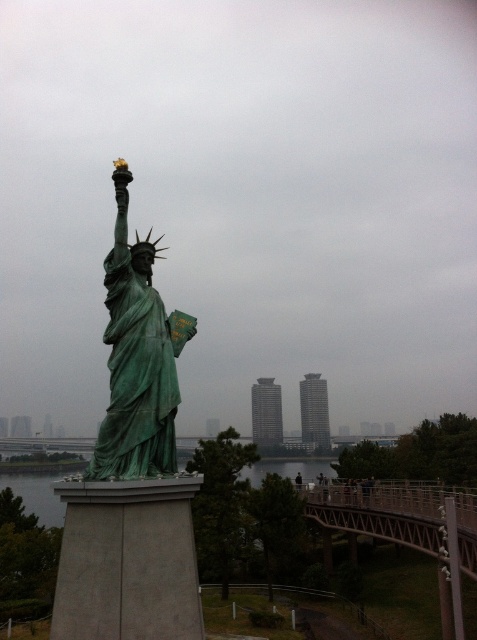
You are standing in front of the miniature Statue of Liberty replica. You want to take a photo that includes both the green patina statue at center and the green patina water at lower left. Based on their positions, which object should you ensure is in the foreground to capture both clearly in your shot?

The green patina statue at center is closer to the viewer than the green patina water at lower left, so you should place the statue in the foreground to ensure both are in focus.

You are standing at the base of the Statue of Liberty replica and notice two points marked in the scene. The first point is at coordinates point [187,336] and the second is at point [288,467]. Which point is closer to you?

Point [187,336] is in front of point [288,467], so it is closer to you.

Looking at this image, you are an architect designing a new park layout. You need to place a statue and a water feature such that the statue takes up less space than the water. Looking at the scene, does the green patina statue at center and the green patina water at lower left in the image meet your design requirement?

Yes, the green patina statue at center occupies less space than the green patina water at lower left, so they meet the design requirement.